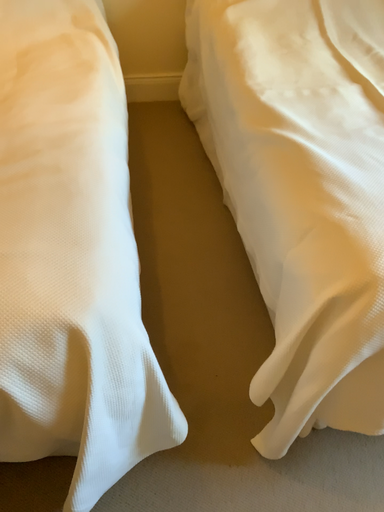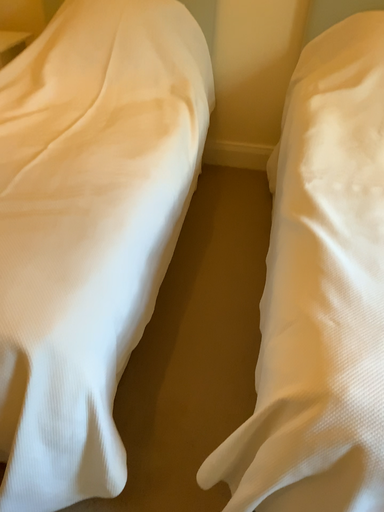
Question: Which way did the camera rotate in the video?

Choices:
 (A) rotated downward
 (B) rotated upward

Answer: (B)